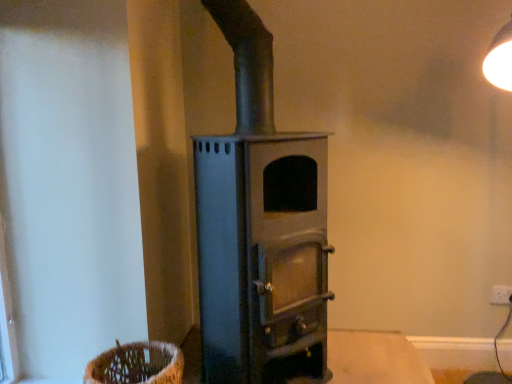
Question: Does smooth wooden table at center touch white plastic electric outlet at lower right?

Choices:
 (A) yes
 (B) no

Answer: (B)

Question: Considering the relative sizes of smooth wooden table at center and white plastic electric outlet at lower right in the image provided, is smooth wooden table at center smaller than white plastic electric outlet at lower right?

Choices:
 (A) yes
 (B) no

Answer: (B)

Question: Can you confirm if smooth wooden table at center is shorter than white plastic electric outlet at lower right?

Choices:
 (A) yes
 (B) no

Answer: (B)

Question: Considering the relative sizes of smooth wooden table at center and white plastic electric outlet at lower right in the image provided, is smooth wooden table at center wider than white plastic electric outlet at lower right?

Choices:
 (A) yes
 (B) no

Answer: (A)

Question: Can you confirm if smooth wooden table at center is bigger than white plastic electric outlet at lower right?

Choices:
 (A) no
 (B) yes

Answer: (B)

Question: Is smooth wooden table at center looking in the opposite direction of white plastic electric outlet at lower right?

Choices:
 (A) no
 (B) yes

Answer: (A)

Question: Is smooth wooden table at center outside matte gray wood burning stove at center?

Choices:
 (A) yes
 (B) no

Answer: (A)

Question: Does smooth wooden table at center appear on the right side of matte gray wood burning stove at center?

Choices:
 (A) yes
 (B) no

Answer: (A)

Question: Does smooth wooden table at center have a lesser width compared to matte gray wood burning stove at center?

Choices:
 (A) yes
 (B) no

Answer: (B)

Question: Is matte gray wood burning stove at center at the back of smooth wooden table at center?

Choices:
 (A) yes
 (B) no

Answer: (B)

Question: From the image's perspective, is smooth wooden table at center on matte gray wood burning stove at center?

Choices:
 (A) no
 (B) yes

Answer: (A)

Question: Can you confirm if smooth wooden table at center is shorter than matte gray wood burning stove at center?

Choices:
 (A) yes
 (B) no

Answer: (A)

Question: From a real-world perspective, is smooth wooden table at center positioned over woven brown basket at lower left based on gravity?

Choices:
 (A) no
 (B) yes

Answer: (A)